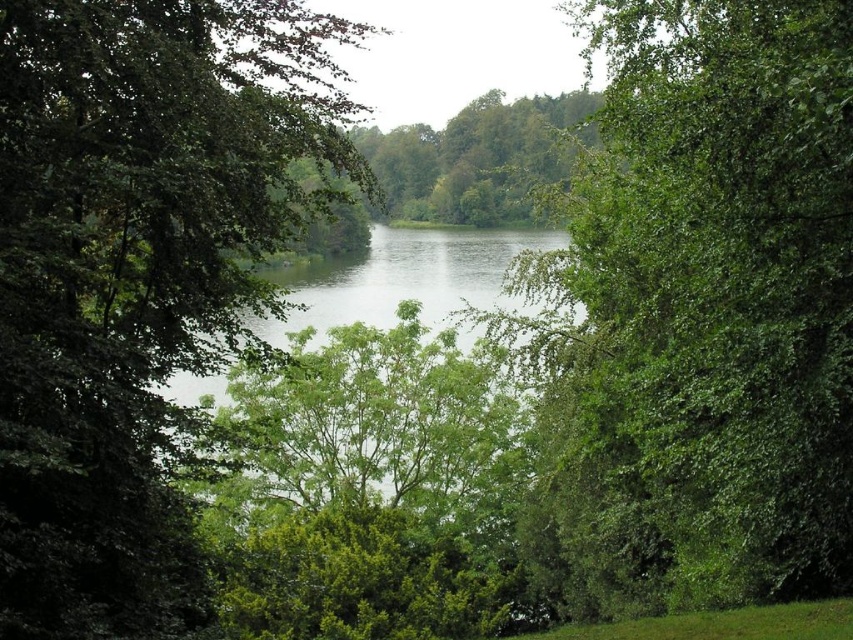
Question: Does green leafy tree at center appear under green leafy tree at left?

Choices:
 (A) yes
 (B) no

Answer: (A)

Question: Which object is farther from the camera taking this photo?

Choices:
 (A) green leafy tree at left
 (B) green leafy tree at center

Answer: (B)

Question: Is green leafy tree at center below green leafy tree at left?

Choices:
 (A) yes
 (B) no

Answer: (A)

Question: Is green leafy tree at center smaller than green leafy tree at left?

Choices:
 (A) yes
 (B) no

Answer: (B)

Question: Among these objects, which one is nearest to the camera?

Choices:
 (A) green leafy tree at center
 (B) green leafy tree at left

Answer: (B)